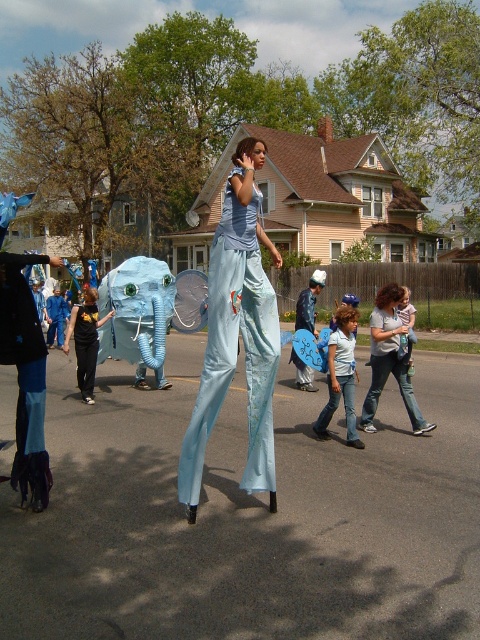
Question: Considering the relative positions of light blue fabric elephant at center and light blue fabric pants at center in the image provided, where is light blue fabric elephant at center located with respect to light blue fabric pants at center?

Choices:
 (A) right
 (B) left

Answer: (A)

Question: Considering the real-world distances, which object is farthest from the blue jeans at center?

Choices:
 (A) light blue fabric elephant at center
 (B) curly hair woman at center
 (C) black matte shirt at center

Answer: (A)

Question: Which of these objects is positioned closest to the blue fabric elephant at center?

Choices:
 (A) curly hair woman at center
 (B) blue jeans at center
 (C) black cotton t-shirt at left

Answer: (A)

Question: Considering the relative positions of light blue fabric pants at center and blue fabric elephant at center in the image provided, where is light blue fabric pants at center located with respect to blue fabric elephant at center?

Choices:
 (A) right
 (B) left

Answer: (B)

Question: Considering the relative positions of light blue fabric pants at center and blue jeans at center in the image provided, where is light blue fabric pants at center located with respect to blue jeans at center?

Choices:
 (A) left
 (B) right

Answer: (A)

Question: Which object is farther from the camera taking this photo?

Choices:
 (A) light blue fabric pants at center
 (B) curly hair woman at center

Answer: (B)